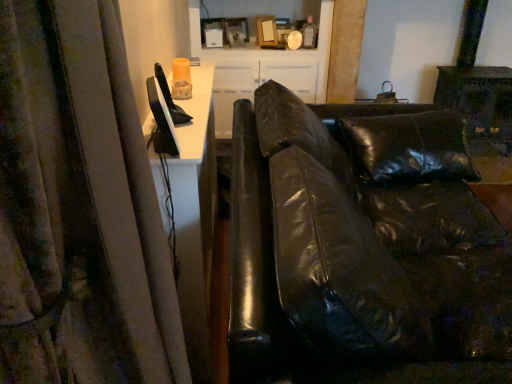
What is the approximate height of matte white cabinet at upper center?

matte white cabinet at upper center is 30.66 inches in height.

This screenshot has width=512, height=384. What do you see at coordinates (262, 57) in the screenshot?
I see `matte white cabinet at upper center` at bounding box center [262, 57].

Locate an element on the screen. The width and height of the screenshot is (512, 384). matte white cabinet at upper center is located at coordinates (262, 57).

Measure the distance between point (210, 5) and camera.

Point (210, 5) is 9.66 feet from camera.

Find the location of a particular element. The width and height of the screenshot is (512, 384). black leather couch at center is located at coordinates (359, 244).

What do you see at coordinates (359, 244) in the screenshot? I see `black leather couch at center` at bounding box center [359, 244].

Measure the distance between black leather couch at center and camera.

The depth of black leather couch at center is 29.26 inches.

You are a GUI agent. You are given a task and a screenshot of the screen. Output one action in this format:
    pyautogui.click(x=<x>, y=<y>)
    Task: Click on the matte white cabinet at upper center
    The image size is (512, 384).
    Given the screenshot: What is the action you would take?
    pyautogui.click(x=262, y=57)

Considering the positions of objects matte white cabinet at upper center and black leather couch at center in the image provided, who is more to the left, matte white cabinet at upper center or black leather couch at center?

matte white cabinet at upper center is more to the left.

Which object is more forward, matte white cabinet at upper center or black leather couch at center?

black leather couch at center is closer to the camera.

Considering the points (275, 51) and (499, 273), which point is behind, point (275, 51) or point (499, 273)?

The point (275, 51) is behind.

From the image's perspective, would you say matte white cabinet at upper center is positioned over black leather couch at center?

Yes, from the image's perspective, matte white cabinet at upper center is on top of black leather couch at center.

Based on the photo, from a real-world perspective, who is located lower, matte white cabinet at upper center or black leather couch at center?

black leather couch at center.

Considering the sizes of objects matte white cabinet at upper center and black leather couch at center in the image provided, who is thinner, matte white cabinet at upper center or black leather couch at center?

matte white cabinet at upper center is thinner.

In the scene shown: From their relative heights in the image, would you say matte white cabinet at upper center is taller or shorter than black leather couch at center?

Considering their sizes, matte white cabinet at upper center has less height than black leather couch at center.

From the picture: Considering the sizes of objects matte white cabinet at upper center and black leather couch at center in the image provided, who is smaller, matte white cabinet at upper center or black leather couch at center?

With smaller size is matte white cabinet at upper center.

Would you say matte white cabinet at upper center is inside or outside black leather couch at center?

matte white cabinet at upper center exists outside the volume of black leather couch at center.

Is matte white cabinet at upper center positioned far away from black leather couch at center?

Absolutely, matte white cabinet at upper center is distant from black leather couch at center.

Is matte white cabinet at upper center facing away from black leather couch at center?

No, matte white cabinet at upper center is not facing the opposite direction of black leather couch at center.

Can you tell me how much matte white cabinet at upper center and black leather couch at center differ in facing direction?

matte white cabinet at upper center and black leather couch at center are facing 88.3 degrees away from each other.

You are a GUI agent. You are given a task and a screenshot of the screen. Output one action in this format:
    pyautogui.click(x=<x>, y=<y>)
    Task: Click on the studio couch that appears below the matte white cabinet at upper center (from a real-world perspective)
    This screenshot has width=512, height=384.
    Given the screenshot: What is the action you would take?
    pyautogui.click(x=359, y=244)

Which is more to the right, black leather couch at center or matte white cabinet at upper center?

black leather couch at center is more to the right.

Relative to matte white cabinet at upper center, is black leather couch at center in front or behind?

Clearly, black leather couch at center is in front of matte white cabinet at upper center.

Does point (394, 194) come behind point (214, 83)?

No, (394, 194) is in front of (214, 83).

From the image's perspective, which object appears higher, black leather couch at center or matte white cabinet at upper center?

From the image's view, matte white cabinet at upper center is above.

From a real-world perspective, between black leather couch at center and matte white cabinet at upper center, who is vertically lower?

In real-world perspective, black leather couch at center is lower.

Between black leather couch at center and matte white cabinet at upper center, which one has smaller width?

Thinner between the two is matte white cabinet at upper center.

Which of these two, black leather couch at center or matte white cabinet at upper center, stands taller?

Standing taller between the two is black leather couch at center.

Can you confirm if black leather couch at center is bigger than matte white cabinet at upper center?

Correct, black leather couch at center is larger in size than matte white cabinet at upper center.

Does black leather couch at center contain matte white cabinet at upper center?

No, matte white cabinet at upper center is not inside black leather couch at center.

Is black leather couch at center touching matte white cabinet at upper center?

No, black leather couch at center is not next to matte white cabinet at upper center.

Could you tell me if black leather couch at center is facing matte white cabinet at upper center?

No, black leather couch at center is not facing towards matte white cabinet at upper center.

Can you tell me how much black leather couch at center and matte white cabinet at upper center differ in facing direction?

The angle between the facing direction of black leather couch at center and the facing direction of matte white cabinet at upper center is 88.3 degrees.

I want to click on entertainment center located above the black leather couch at center (from the image's perspective), so click(262, 57).

I want to click on entertainment center that appears above the black leather couch at center (from a real-world perspective), so click(x=262, y=57).

The width and height of the screenshot is (512, 384). I want to click on studio couch lying on the right of matte white cabinet at upper center, so click(x=359, y=244).